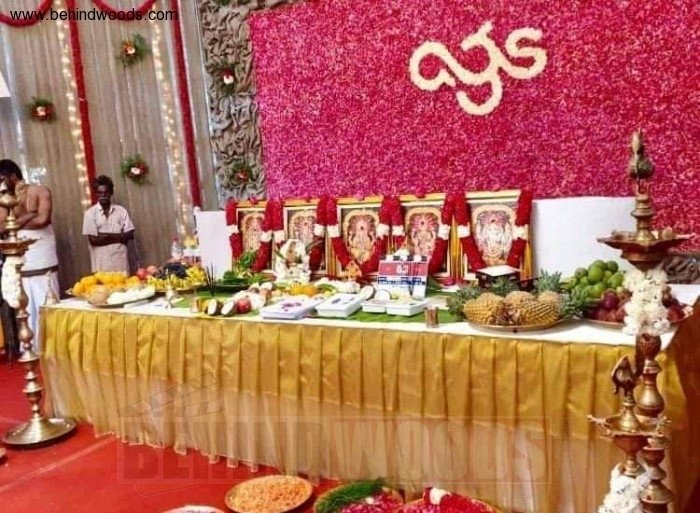
The height and width of the screenshot is (513, 700). I want to click on plate, so click(x=533, y=325).